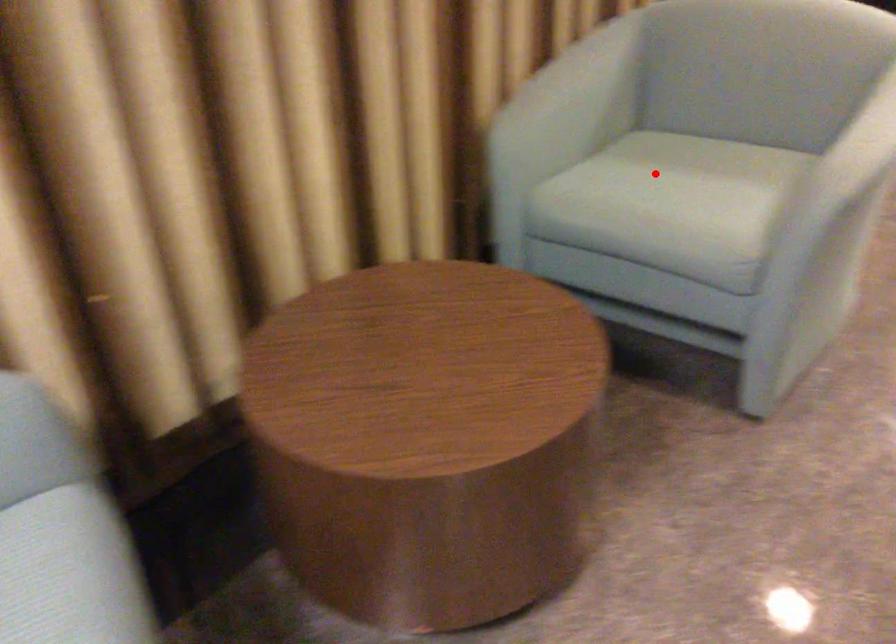
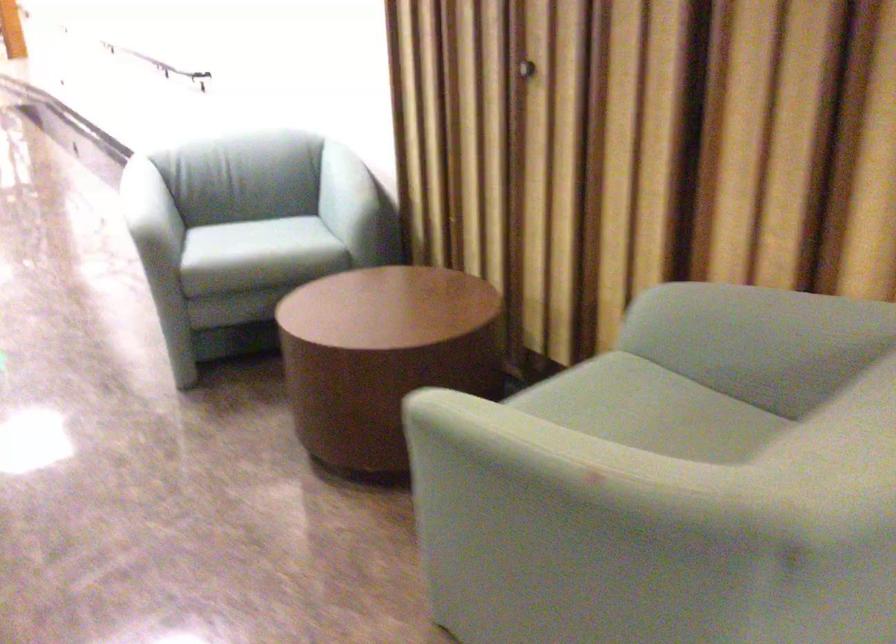
Find the pixel in the second image that matches the highlighted location in the first image.

(650, 410)